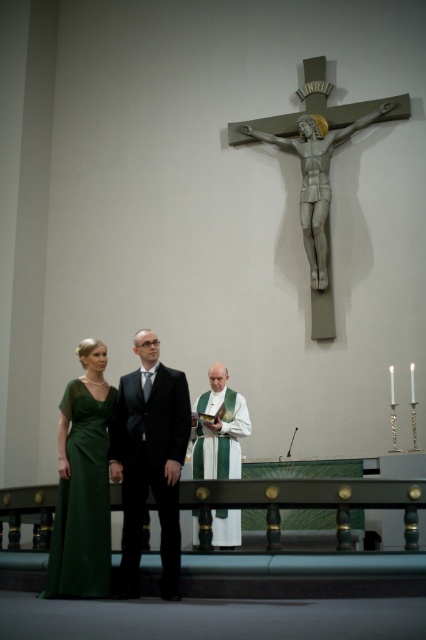
What do you see at coordinates (149, 460) in the screenshot? The height and width of the screenshot is (640, 426). I see `shiny black suit at center` at bounding box center [149, 460].

Is point (166, 573) positioned behind point (201, 468)?

No, it is not.

The image size is (426, 640). Find the location of `shiny black suit at center`. shiny black suit at center is located at coordinates (149, 460).

Which is behind, point (80, 422) or point (222, 524)?

The point (222, 524) is behind.

Is point (83, 442) positioned before point (230, 452)?

Yes, point (83, 442) is closer to viewer.

What are the coordinates of `green satin dress at left` in the screenshot? It's located at (83, 500).

Can you confirm if green satin dress at center is bigger than shiny black suit at center?

Indeed, green satin dress at center has a larger size compared to shiny black suit at center.

What do you see at coordinates (149, 460) in the screenshot? The width and height of the screenshot is (426, 640). I see `green satin dress at center` at bounding box center [149, 460].

Is point (138, 584) closer to camera compared to point (143, 420)?

Yes, it is in front of point (143, 420).

You are a GUI agent. You are given a task and a screenshot of the screen. Output one action in this format:
    pyautogui.click(x=<x>, y=<y>)
    Task: Click on the green satin dress at center
    
    Given the screenshot: What is the action you would take?
    pyautogui.click(x=149, y=460)